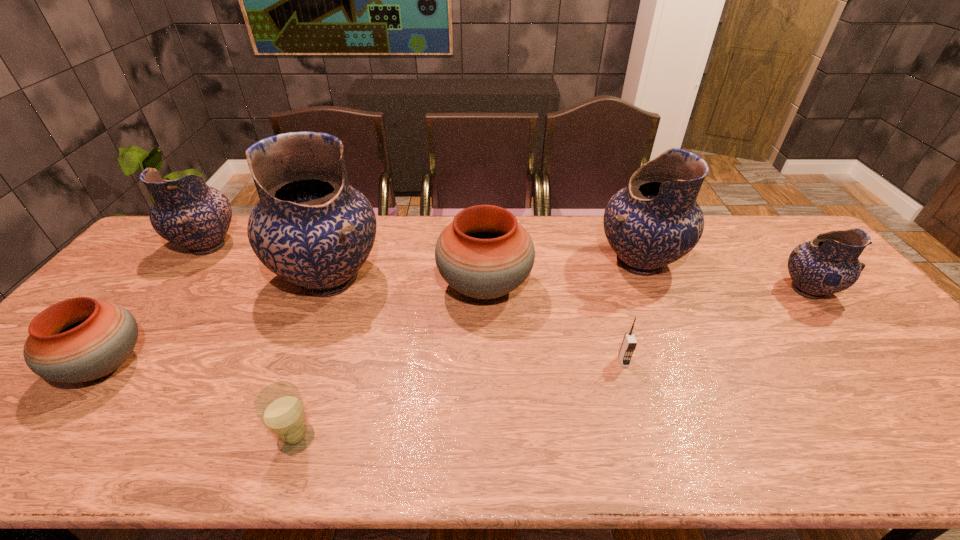
This screenshot has width=960, height=540. I want to click on free space located 0.070m on the left of the smaller red pottery, so click(35, 366).

The height and width of the screenshot is (540, 960). I want to click on vacant space located 0.230m on the front-facing side of the cellular telephone, so click(653, 458).

Locate an element on the screen. This screenshot has width=960, height=540. vacant space located 0.200m on the back of the nearest object is located at coordinates (326, 350).

Locate an element on the screen. Image resolution: width=960 pixels, height=540 pixels. object at the near edge is located at coordinates (279, 406).

Find the location of a particular element. This screenshot has height=540, width=960. object situated at the right edge is located at coordinates (828, 264).

Locate an element on the screen. The image size is (960, 540). object positioned at the far left corner is located at coordinates (187, 212).

Locate an element on the screen. This screenshot has height=540, width=960. free space at the far edge of the desktop is located at coordinates (552, 230).

Locate an element on the screen. This screenshot has height=540, width=960. vacant point at the near edge is located at coordinates (697, 444).

Identify the location of free space at the left edge of the desktop. (169, 262).

This screenshot has width=960, height=540. In the image, there is a desktop. Identify the location of free region at the right edge. (887, 347).